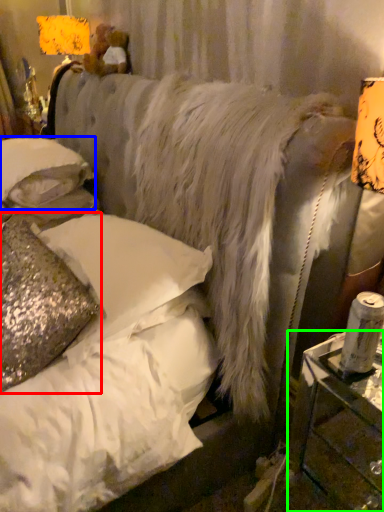
Question: Estimate the real-world distances between objects in this image. Which object is closer to pillow (highlighted by a red box), pillow (highlighted by a blue box) or table (highlighted by a green box)?

Choices:
 (A) pillow
 (B) table

Answer: (A)